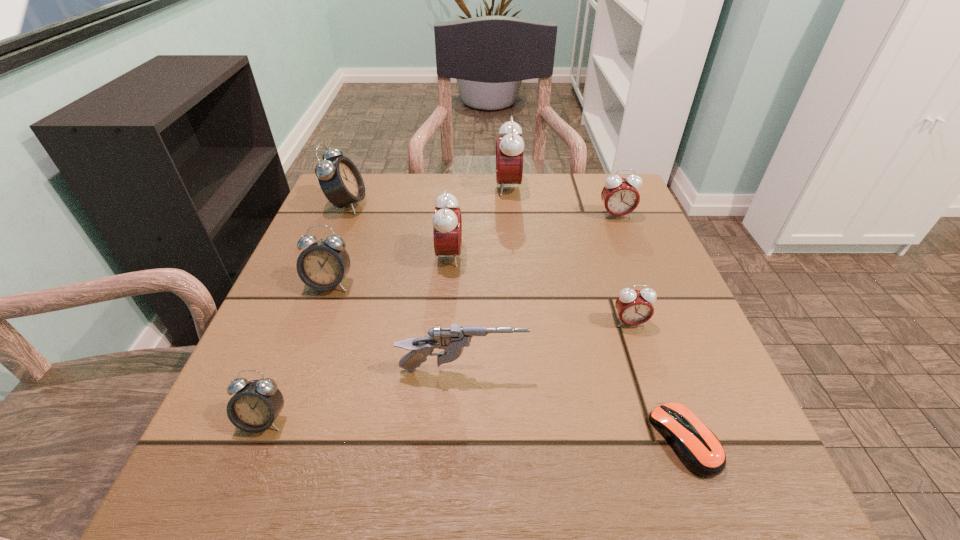
At what (x,y) coordinates should I click in order to perform the action: click on pink alarm clock object that ranks as the third closest to the fourth nearest object. Please return your answer as a coordinate pair (x, y). Image resolution: width=960 pixels, height=540 pixels. Looking at the image, I should click on (509, 149).

In order to click on the closest pink alarm clock relative to the biggest pink alarm clock in this screenshot , I will do `click(619, 195)`.

This screenshot has width=960, height=540. I want to click on white alarm clock that is the third closest to the third pink alarm clock from right to left, so click(x=256, y=404).

Find the location of a particular element. the third closest white alarm clock to the seventh farthest object is located at coordinates (340, 180).

This screenshot has height=540, width=960. I want to click on blank area in the image that satisfies the following two spatial constraints: 1. at the barrel of the gun; 2. on the back side of the orange computer mouse, so click(460, 440).

This screenshot has width=960, height=540. In order to click on vacant region that satisfies the following two spatial constraints: 1. on the clock face of the third farthest pink alarm clock; 2. on the face of the second smallest white alarm clock in this screenshot , I will do `click(447, 284)`.

Identify the location of free spot that satisfies the following two spatial constraints: 1. on the clock face of the smallest pink alarm clock; 2. at the barrel of the seventh farthest object. The height and width of the screenshot is (540, 960). (646, 370).

Where is `blank space that satisfies the following two spatial constraints: 1. on the clock face of the fourth alarm clock from left to right; 2. on the back side of the computer mouse`? This screenshot has width=960, height=540. blank space that satisfies the following two spatial constraints: 1. on the clock face of the fourth alarm clock from left to right; 2. on the back side of the computer mouse is located at coordinates (434, 440).

At what (x,y) coordinates should I click in order to perform the action: click on vacant position in the image that satisfies the following two spatial constraints: 1. on the back side of the computer mouse; 2. on the clock face of the second pink alarm clock from left to right. Please return your answer as a coordinate pair (x, y). Looking at the image, I should click on (592, 187).